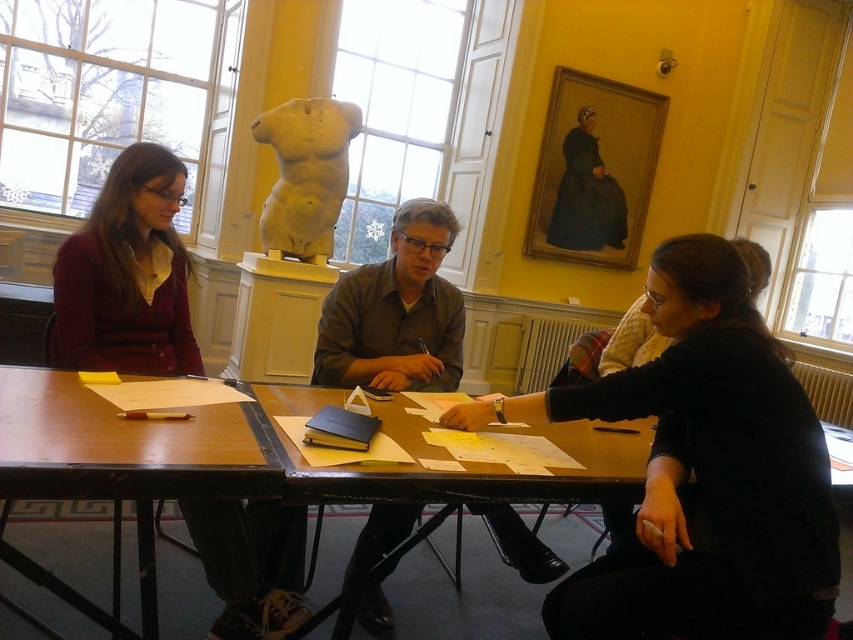
You are standing in the room and see the point at coordinates (126, 275). Which object is this point located on?

The point at coordinates (126, 275) is located on the matte maroon sweater at left.

You are standing in the room and want to place a new painting on the wall behind the wooden table at center. Considering the white marble torso at center is near the window, will the sculpture block your view of the painting from where you are standing?

The wooden table at center is closer to the viewer than the white marble torso at center. Since the table is closer, placing the painting behind it would mean the sculpture is further back, so the white marble torso at center would not block the view of the painting from your current position.

You are an interior designer planning to place a new lamp on the table. The lamp requires a space that is not blocked by any objects. Based on the scene, which object is closer to you, the matte maroon sweater at left or the white marble torso at center, so you can avoid placing the lamp there?

The matte maroon sweater at left is closer to you than the white marble torso at center, so you should avoid placing the lamp near the matte maroon sweater at left to ensure it is not blocked.